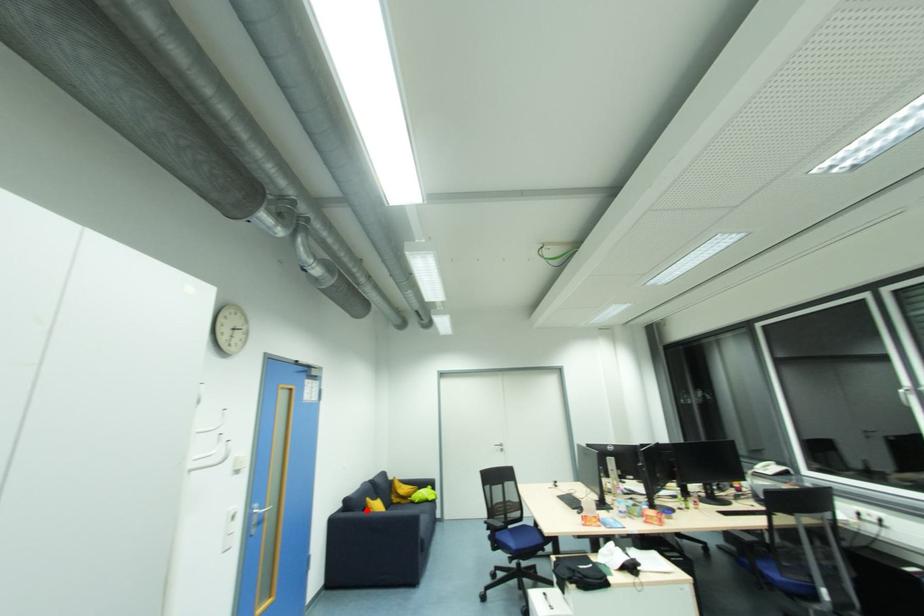
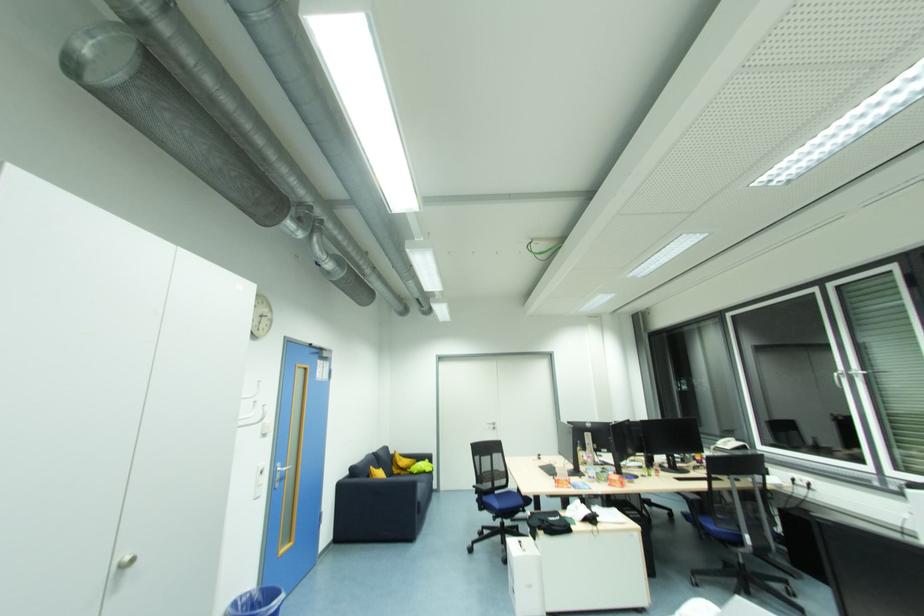
The point at the highlighted location is marked in the first image. Where is the corresponding point in the second image?

(371, 477)